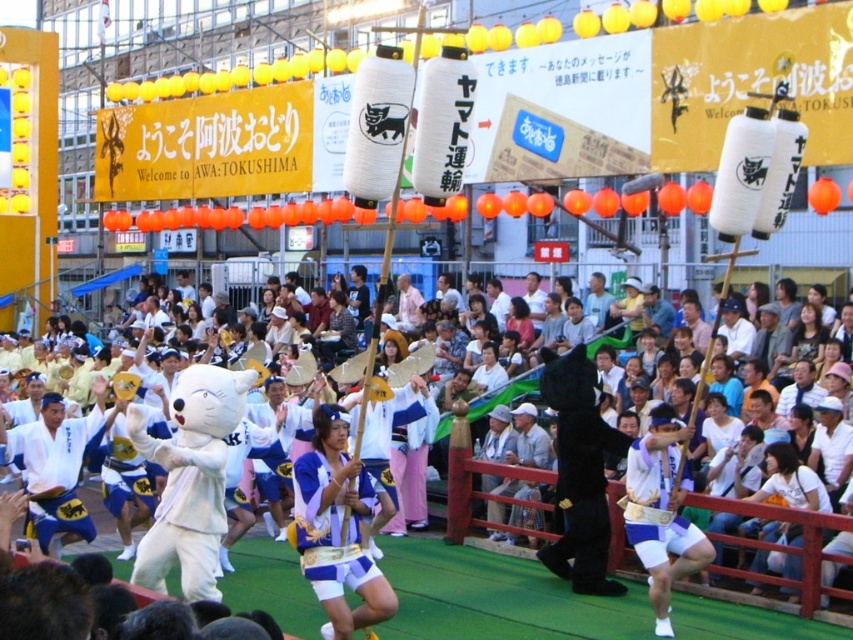
You are a photographer at the Awa Odori festival. You want to capture a photo of the blue fabric costume at center and the white fabric mask at center. Which object is positioned higher in the frame?

The blue fabric costume at center is located above the white fabric mask at center, so it is positioned higher in the frame.

You are a festival attendee holding a 1.5 meter long banner. You want to display it between the white plush mascot at center and the blue fabric costume at center. Is there enough space to stretch the banner fully between them?

The distance between the white plush mascot at center and the blue fabric costume at center is 9.13 meters, which is more than enough to stretch the 1.5 meter banner fully between them.

You are a photographer at the Awa Odori festival and want to capture both the white plush mascot at center and the blue fabric costume at center in a single frame. Which one should you focus on first to ensure they are both in focus?

The white plush mascot at center has a larger size compared to blue fabric costume at center. Since the mascot is larger, focusing on it first will help ensure both are in focus as it occupies more of the frame.